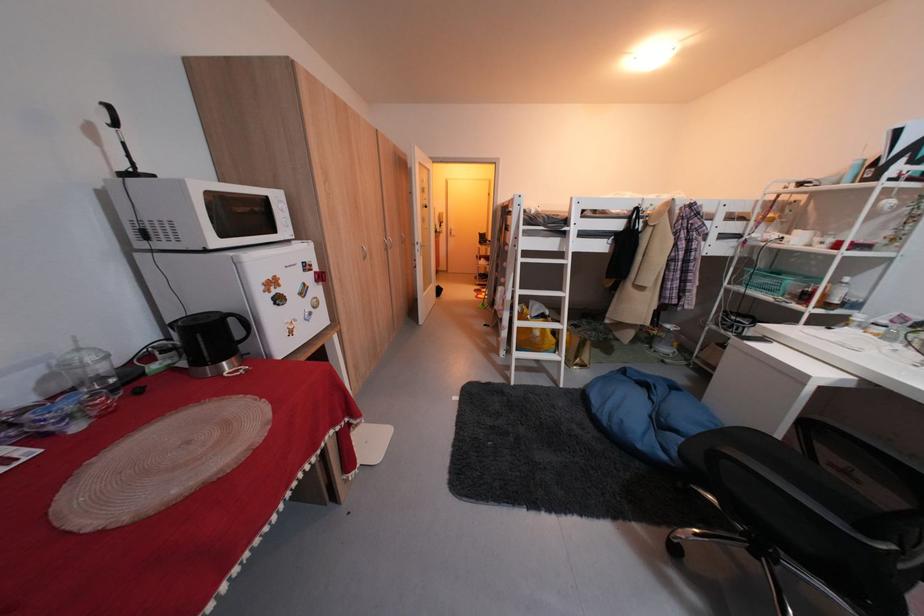
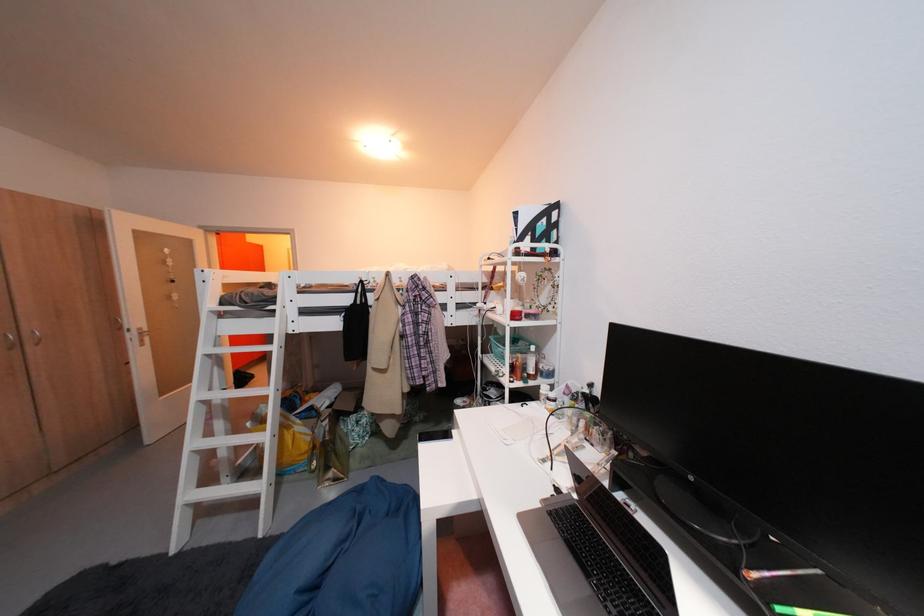
Where in the second image is the point corresponding to pixel 429 245 from the first image?

(140, 331)